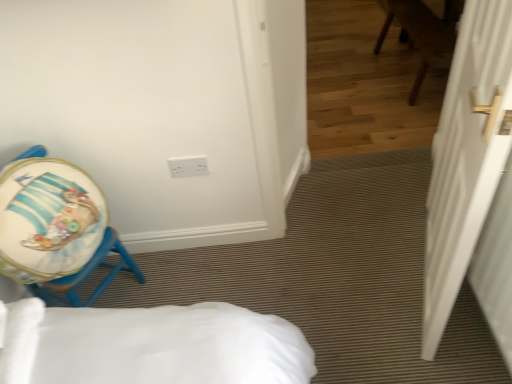
Question: Is matte blue stool at left smaller than white matte door at right?

Choices:
 (A) yes
 (B) no

Answer: (A)

Question: From a real-world perspective, is matte blue stool at left located higher than white matte door at right?

Choices:
 (A) yes
 (B) no

Answer: (B)

Question: Is matte blue stool at left turned away from white matte door at right?

Choices:
 (A) no
 (B) yes

Answer: (A)

Question: Is matte blue stool at left to the right of white matte door at right from the viewer's perspective?

Choices:
 (A) no
 (B) yes

Answer: (A)

Question: Is matte blue stool at left not inside white matte door at right?

Choices:
 (A) yes
 (B) no

Answer: (A)

Question: Is the position of matte blue stool at left less distant than that of white matte door at right?

Choices:
 (A) yes
 (B) no

Answer: (B)

Question: Considering the relative sizes of matte blue stool at left and white plastic electric outlet at upper center in the image provided, is matte blue stool at left smaller than white plastic electric outlet at upper center?

Choices:
 (A) yes
 (B) no

Answer: (B)

Question: Considering the relative sizes of matte blue stool at left and white plastic electric outlet at upper center in the image provided, is matte blue stool at left bigger than white plastic electric outlet at upper center?

Choices:
 (A) yes
 (B) no

Answer: (A)

Question: Is matte blue stool at left positioned behind white plastic electric outlet at upper center?

Choices:
 (A) no
 (B) yes

Answer: (A)

Question: Is white plastic electric outlet at upper center surrounded by matte blue stool at left?

Choices:
 (A) no
 (B) yes

Answer: (A)

Question: Is matte blue stool at left touching white plastic electric outlet at upper center?

Choices:
 (A) no
 (B) yes

Answer: (A)

Question: From a real-world perspective, is matte blue stool at left on top of white plastic electric outlet at upper center?

Choices:
 (A) yes
 (B) no

Answer: (A)

Question: Can you confirm if white matte door at right is wider than matte blue stool at left?

Choices:
 (A) no
 (B) yes

Answer: (A)